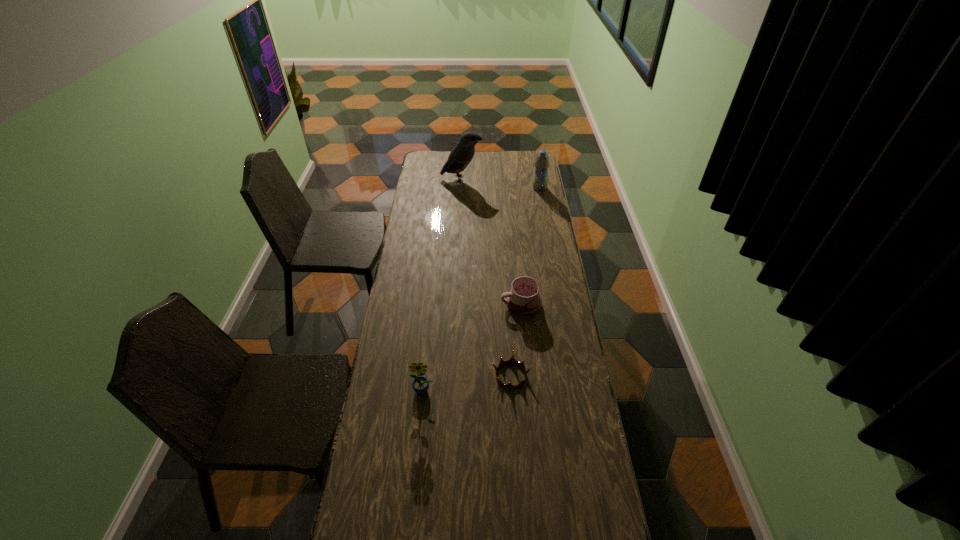
The height and width of the screenshot is (540, 960). What are the coordinates of `parrot` in the screenshot? It's located at (461, 155).

The height and width of the screenshot is (540, 960). I want to click on the farthest object, so click(461, 155).

Identify the location of water bottle. The width and height of the screenshot is (960, 540). (542, 161).

This screenshot has width=960, height=540. I want to click on the fourth nearest object, so click(x=542, y=161).

Locate an element on the screen. sunflower is located at coordinates (420, 385).

Identify the location of mug. The height and width of the screenshot is (540, 960). (523, 299).

Locate an element on the screen. The height and width of the screenshot is (540, 960). the third nearest object is located at coordinates (523, 299).

Locate an element on the screen. This screenshot has height=540, width=960. the shortest object is located at coordinates (512, 360).

Locate an element on the screen. This screenshot has width=960, height=540. vacant space located 0.310m on the front-facing side of the parrot is located at coordinates (537, 179).

Where is `vacant point located 0.370m on the back of the rightmost object`? vacant point located 0.370m on the back of the rightmost object is located at coordinates (533, 152).